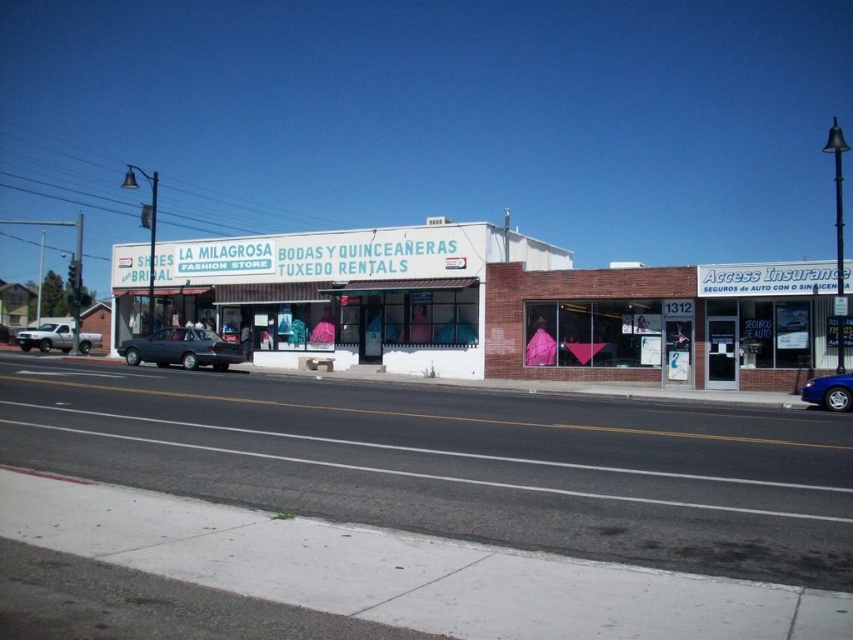
You are standing at the point labeled point (181, 348) in the street scene. What object are you directly facing?

The point labeled point (181, 348) corresponds to the matte black sedan at center, so you are directly facing the matte black sedan at center.

You are a delivery driver needing to park your truck, which is 6 meters long, in the street between the two storefronts. The available space between the matte black sedan at center and the silver metallic truck at left is 11.41 meters. Can your truck fit in this space without needing to move either vehicle?

The available space between the matte black sedan at center and the silver metallic truck at left is 11.41 meters. Since your truck is 6 meters long, it can fit comfortably within the 11.41 meter space without needing to move either vehicle.

You are a delivery driver who needs to park your vehicle between the matte black sedan at center and the silver metallic truck at left. Based on the scene, can you safely park your vehicle there without blocking the storefronts?

The matte black sedan at center is below the silver metallic truck at left, meaning they are parked in different levels or positions. Since they are not adjacent horizontally, there might not be enough space between them for your vehicle. Check the layout carefully before deciding.